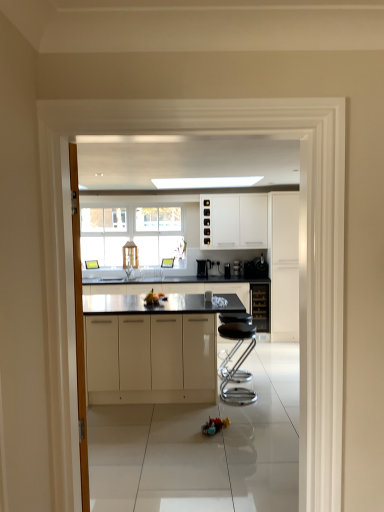
Question: Does black glass wine cooler at center, which is counted as the third cabinetry, starting from the front, turn towards white glossy cabinets at upper center, arranged as the 1th cabinetry when viewed from the back?

Choices:
 (A) no
 (B) yes

Answer: (A)

Question: Considering the relative positions of black glass wine cooler at center, marked as the 2th cabinetry in a back-to-front arrangement, and white glossy cabinets at upper center, which ranks as the second cabinetry in left-to-right order, in the image provided, is black glass wine cooler at center, marked as the 2th cabinetry in a back-to-front arrangement, to the right of white glossy cabinets at upper center, which ranks as the second cabinetry in left-to-right order, from the viewer's perspective?

Choices:
 (A) no
 (B) yes

Answer: (B)

Question: Is black glass wine cooler at center, marked as the 2th cabinetry in a back-to-front arrangement, placed right next to white glossy cabinets at upper center, which ranks as the 4th cabinetry in front-to-back order?

Choices:
 (A) no
 (B) yes

Answer: (A)

Question: From a real-world perspective, does black glass wine cooler at center, arranged as the 3th cabinetry when viewed from the left, stand above white glossy cabinets at upper center, arranged as the 1th cabinetry when viewed from the back?

Choices:
 (A) no
 (B) yes

Answer: (A)

Question: Are black glass wine cooler at center, arranged as the 3th cabinetry when viewed from the left, and white glossy cabinets at upper center, which ranks as the 4th cabinetry in front-to-back order, located far from each other?

Choices:
 (A) no
 (B) yes

Answer: (A)

Question: In the image, is black glass wine cooler at center, marked as the 2th cabinetry in a back-to-front arrangement, on the left side or the right side of white glossy cabinet at right, the 3th cabinetry when ordered from back to front?

Choices:
 (A) right
 (B) left

Answer: (B)

Question: Considering the positions of black glass wine cooler at center, which appears as the second cabinetry when viewed from the right, and white glossy cabinet at right, the 3th cabinetry when ordered from back to front, in the image, is black glass wine cooler at center, which appears as the second cabinetry when viewed from the right, bigger or smaller than white glossy cabinet at right, the 3th cabinetry when ordered from back to front,?

Choices:
 (A) big
 (B) small

Answer: (B)

Question: Considering the positions of point coord(266,323) and point coord(288,221), is point coord(266,323) closer or farther from the camera than point coord(288,221)?

Choices:
 (A) closer
 (B) farther

Answer: (B)

Question: From the image's perspective, is black glass wine cooler at center, which is counted as the third cabinetry, starting from the front, positioned above or below white glossy cabinet at right, which is the second cabinetry from front to back?

Choices:
 (A) above
 (B) below

Answer: (B)

Question: Does point (256, 318) appear closer or farther from the camera than point (233, 267)?

Choices:
 (A) farther
 (B) closer

Answer: (A)

Question: From a real-world perspective, is black glass wine cooler at center, marked as the 2th cabinetry in a back-to-front arrangement, above or below satin black coffee machine at center?

Choices:
 (A) below
 (B) above

Answer: (A)

Question: From their relative heights in the image, would you say black glass wine cooler at center, which appears as the second cabinetry when viewed from the right, is taller or shorter than satin black coffee machine at center?

Choices:
 (A) short
 (B) tall

Answer: (B)

Question: Considering the positions of black glass wine cooler at center, arranged as the 3th cabinetry when viewed from the left, and satin black coffee machine at center in the image, is black glass wine cooler at center, arranged as the 3th cabinetry when viewed from the left, wider or thinner than satin black coffee machine at center?

Choices:
 (A) wide
 (B) thin

Answer: (A)

Question: Looking at the image, does metallic silver bar stool at center seem bigger or smaller compared to satin black coffee maker at center, the second appliance in the left-to-right sequence?

Choices:
 (A) big
 (B) small

Answer: (A)

Question: From the image's perspective, relative to satin black coffee maker at center, arranged as the first appliance when viewed from the right, is metallic silver bar stool at center above or below?

Choices:
 (A) below
 (B) above

Answer: (A)